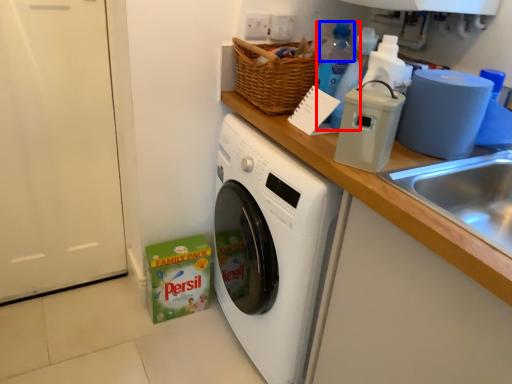
Question: Which of the following is the closest to the observer, bottle (highlighted by a red box) or bottle (highlighted by a blue box)?

Choices:
 (A) bottle
 (B) bottle

Answer: (A)